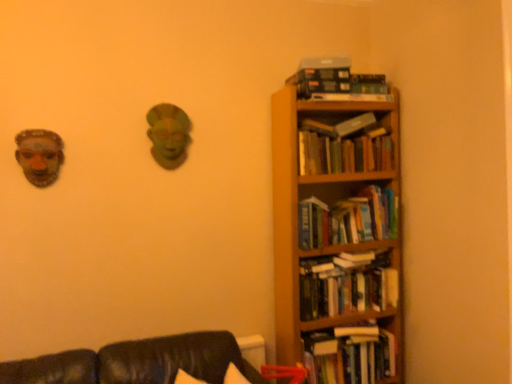
Question: Does hardcover books at right, marked as the 4th book in a bottom-to-top arrangement, have a smaller size compared to hardcover book at upper right?

Choices:
 (A) yes
 (B) no

Answer: (B)

Question: Is hardcover books at right, the 2th book positioned from the top, positioned with its back to hardcover book at upper right?

Choices:
 (A) no
 (B) yes

Answer: (A)

Question: Can you confirm if hardcover books at right, the 2th book positioned from the top, is thinner than hardcover book at upper right?

Choices:
 (A) no
 (B) yes

Answer: (A)

Question: From the image's perspective, is hardcover books at right, the 2th book positioned from the top, under hardcover book at upper right?

Choices:
 (A) no
 (B) yes

Answer: (B)

Question: Is hardcover books at right, the 2th book positioned from the top, located outside hardcover book at upper right?

Choices:
 (A) no
 (B) yes

Answer: (B)

Question: From a real-world perspective, is hardcover books at right, placed as the first book when sorted from bottom to top, above or below hardcover books at upper right, which is the first book in top-to-bottom order?

Choices:
 (A) above
 (B) below

Answer: (B)

Question: Does point (347, 326) appear closer or farther from the camera than point (302, 77)?

Choices:
 (A) farther
 (B) closer

Answer: (A)

Question: Based on their positions, is hardcover books at right, placed as the first book when sorted from bottom to top, located to the left or right of hardcover books at upper right, which is counted as the 5th book, starting from the bottom?

Choices:
 (A) left
 (B) right

Answer: (B)

Question: Is hardcover books at right, placed as the first book when sorted from bottom to top, wider or thinner than hardcover books at upper right, which is counted as the 5th book, starting from the bottom?

Choices:
 (A) thin
 (B) wide

Answer: (B)

Question: Is point (365, 115) closer or farther from the camera than point (337, 76)?

Choices:
 (A) farther
 (B) closer

Answer: (A)

Question: From the image's perspective, is hardcover book at upper right positioned above or below hardcover books at upper right, which is counted as the 5th book, starting from the bottom?

Choices:
 (A) above
 (B) below

Answer: (B)

Question: Visually, is hardcover book at upper right positioned to the left or to the right of hardcover books at upper right, which is counted as the 5th book, starting from the bottom?

Choices:
 (A) right
 (B) left

Answer: (A)

Question: In the image, is hardcover book at upper right positioned in front of or behind hardcover books at upper right, which is the first book in top-to-bottom order?

Choices:
 (A) behind
 (B) front

Answer: (A)

Question: Considering the positions of hardcover books at upper right, which is counted as the 5th book, starting from the bottom, and wooden bookcase at right in the image, is hardcover books at upper right, which is counted as the 5th book, starting from the bottom, wider or thinner than wooden bookcase at right?

Choices:
 (A) thin
 (B) wide

Answer: (A)

Question: From a real-world perspective, relative to wooden bookcase at right, is hardcover books at upper right, which is the first book in top-to-bottom order, vertically above or below?

Choices:
 (A) above
 (B) below

Answer: (A)